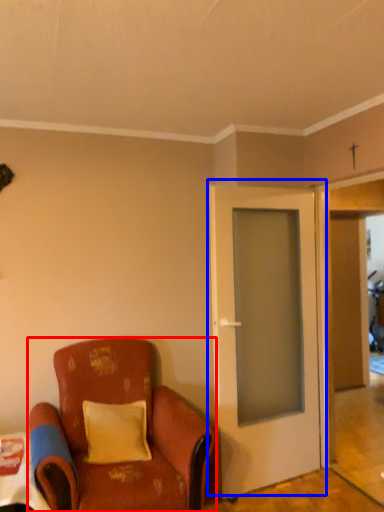
Question: Which object is further to the camera taking this photo, chair (highlighted by a red box) or door (highlighted by a blue box)?

Choices:
 (A) chair
 (B) door

Answer: (B)